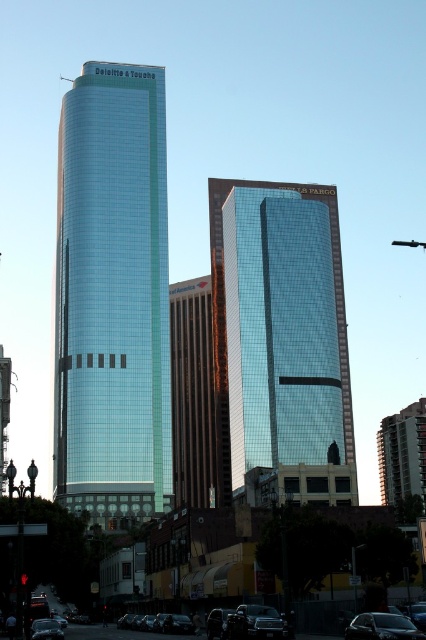
Question: Is the position of shiny black car at center less distant than that of shiny black sedan at lower right?

Choices:
 (A) yes
 (B) no

Answer: (B)

Question: Is the position of glassy blue skyscraper at left less distant than that of glassy reflective skyscraper at center?

Choices:
 (A) yes
 (B) no

Answer: (A)

Question: Considering the real-world distances, which object is farthest from the glassy blue skyscraper at left?

Choices:
 (A) glassy reflective skyscraper at center
 (B) shiny black sedan at lower right
 (C) shiny black car at center
 (D) shiny black car at lower left

Answer: (B)

Question: Which point is farther to the camera?

Choices:
 (A) shiny black sedan at lower right
 (B) shiny black car at lower left
 (C) glassy reflective skyscraper at center

Answer: (C)

Question: Which object is the farthest from the shiny black car at lower left?

Choices:
 (A) shiny black sedan at lower right
 (B) glassy reflective skyscraper at center
 (C) glassy blue skyscraper at left
 (D) shiny black car at center

Answer: (B)

Question: Is shiny black sedan at lower right bigger than shiny black car at lower left?

Choices:
 (A) no
 (B) yes

Answer: (A)